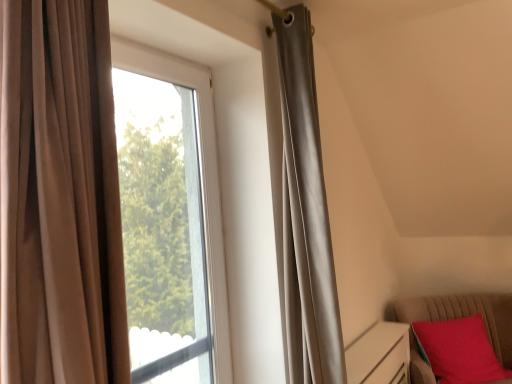
The height and width of the screenshot is (384, 512). What do you see at coordinates (466, 316) in the screenshot? I see `velvet red cushion at lower right` at bounding box center [466, 316].

Where is `velvet red cushion at lower right`? The height and width of the screenshot is (384, 512). velvet red cushion at lower right is located at coordinates (466, 316).

What is the approximate width of transparent glass window at center?

The width of transparent glass window at center is 13.15 centimeters.

The height and width of the screenshot is (384, 512). Describe the element at coordinates (201, 177) in the screenshot. I see `transparent glass window at center` at that location.

At what (x,y) coordinates should I click in order to perform the action: click on transparent glass window at center. Please return your answer as a coordinate pair (x, y). Looking at the image, I should click on [201, 177].

Identify the location of velvet red cushion at lower right. (466, 316).

Which is more to the left, transparent glass window at center or velvet red cushion at lower right?

Positioned to the left is transparent glass window at center.

Is the depth of transparent glass window at center less than that of velvet red cushion at lower right?

Yes, it is.

Does point (213, 125) come in front of point (490, 299)?

Yes.

From the image's perspective, is transparent glass window at center on velvet red cushion at lower right?

Correct, transparent glass window at center appears higher than velvet red cushion at lower right in the image.

From a real-world perspective, is transparent glass window at center on velvet red cushion at lower right?

Yes, from a real-world perspective, transparent glass window at center is above velvet red cushion at lower right.

Considering the sizes of transparent glass window at center and velvet red cushion at lower right in the image, is transparent glass window at center wider or thinner than velvet red cushion at lower right?

transparent glass window at center is thinner than velvet red cushion at lower right.

Is transparent glass window at center taller than velvet red cushion at lower right?

Correct, transparent glass window at center is much taller as velvet red cushion at lower right.

Is transparent glass window at center bigger than velvet red cushion at lower right?

Correct, transparent glass window at center is larger in size than velvet red cushion at lower right.

Do you think transparent glass window at center is within velvet red cushion at lower right, or outside of it?

transparent glass window at center exists outside the volume of velvet red cushion at lower right.

Would you say transparent glass window at center is a long distance from velvet red cushion at lower right?

That's right, there is a large distance between transparent glass window at center and velvet red cushion at lower right.

Is transparent glass window at center oriented away from velvet red cushion at lower right?

No, velvet red cushion at lower right is not at the back of transparent glass window at center.

Find the location of `window to the left of velvet red cushion at lower right`. window to the left of velvet red cushion at lower right is located at coordinates (201, 177).

Would you say velvet red cushion at lower right is to the left or to the right of transparent glass window at center in the picture?

From the image, it's evident that velvet red cushion at lower right is to the right of transparent glass window at center.

Which is behind, velvet red cushion at lower right or transparent glass window at center?

velvet red cushion at lower right is further away from the camera.

Considering the points (443, 311) and (176, 57), which point is in front, point (443, 311) or point (176, 57)?

The point (176, 57) is closer.

From the image's perspective, which one is positioned higher, velvet red cushion at lower right or transparent glass window at center?

transparent glass window at center is shown above in the image.

From a real-world perspective, is velvet red cushion at lower right on top of transparent glass window at center?

No, from a real-world perspective, velvet red cushion at lower right is not over transparent glass window at center

Considering the relative sizes of velvet red cushion at lower right and transparent glass window at center in the image provided, is velvet red cushion at lower right wider than transparent glass window at center?

Correct, the width of velvet red cushion at lower right exceeds that of transparent glass window at center.

Is velvet red cushion at lower right shorter than transparent glass window at center?

Correct, velvet red cushion at lower right is not as tall as transparent glass window at center.

Considering the sizes of objects velvet red cushion at lower right and transparent glass window at center in the image provided, who is bigger, velvet red cushion at lower right or transparent glass window at center?

Bigger between the two is transparent glass window at center.

Is velvet red cushion at lower right situated inside transparent glass window at center or outside?

velvet red cushion at lower right is spatially situated outside transparent glass window at center.

Is velvet red cushion at lower right with transparent glass window at center?

No, velvet red cushion at lower right is not touching transparent glass window at center.

Is velvet red cushion at lower right turned away from transparent glass window at center?

No, velvet red cushion at lower right is not facing the opposite direction of transparent glass window at center.

How different are the orientations of velvet red cushion at lower right and transparent glass window at center in degrees?

50.8 degrees separate the facing orientations of velvet red cushion at lower right and transparent glass window at center.

Where is `furniture located behind the transparent glass window at center`? The height and width of the screenshot is (384, 512). furniture located behind the transparent glass window at center is located at coordinates (466, 316).

This screenshot has width=512, height=384. Identify the location of window on the left of the velvet red cushion at lower right. (201, 177).

The image size is (512, 384). Identify the location of furniture below the transparent glass window at center (from a real-world perspective). (466, 316).